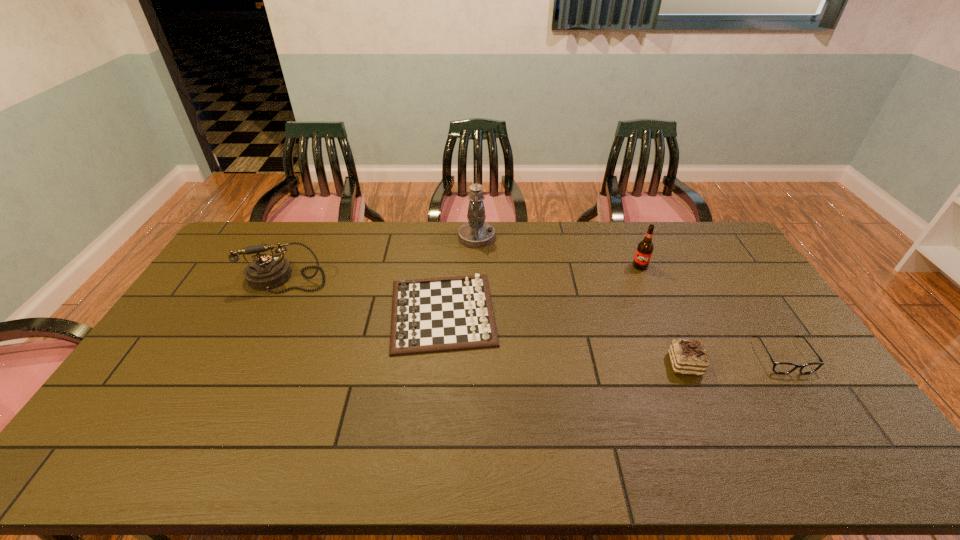
This screenshot has height=540, width=960. Identify the location of vacant space located 0.160m on the right of the telephone. (373, 278).

The height and width of the screenshot is (540, 960). Identify the location of free space located on the left of the chocolate cake. (546, 364).

You are a GUI agent. You are given a task and a screenshot of the screen. Output one action in this format:
    pyautogui.click(x=<x>, y=<y>)
    Task: Click on the free space located on the left of the chessboard
    
    Given the screenshot: What is the action you would take?
    click(347, 313)

At what (x,y) coordinates should I click in order to perform the action: click on vacant position located on the front-facing side of the spectacles. Please return your answer as a coordinate pair (x, y). Looking at the image, I should click on (852, 463).

Locate an element on the screen. The width and height of the screenshot is (960, 540). object present at the far edge is located at coordinates (476, 233).

Locate an element on the screen. object that is at the left edge is located at coordinates (266, 272).

Locate an element on the screen. Image resolution: width=960 pixels, height=540 pixels. object situated at the right edge is located at coordinates (778, 367).

I want to click on free space at the far edge, so click(x=403, y=251).

This screenshot has height=540, width=960. What are the coordinates of `free region at the near edge of the desktop` in the screenshot? It's located at (574, 453).

This screenshot has width=960, height=540. Find the location of `blank space at the near left corner`. blank space at the near left corner is located at coordinates (120, 444).